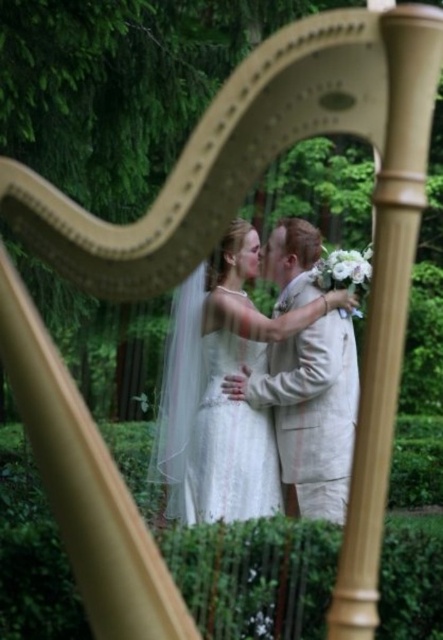
Question: In this image, where is light beige linen suit at center located relative to white lace dress at center?

Choices:
 (A) below
 (B) above

Answer: (B)

Question: Which point appears closest to the camera in this image?

Choices:
 (A) (213, 340)
 (B) (295, 342)

Answer: (A)

Question: Can you confirm if white satin dress at center is wider than light beige linen suit at center?

Choices:
 (A) yes
 (B) no

Answer: (A)

Question: Based on their relative distances, which object is nearer to the light beige linen suit at center?

Choices:
 (A) white satin dress at center
 (B) white lace dress at center

Answer: (A)

Question: Does white satin dress at center appear on the left side of white lace dress at center?

Choices:
 (A) yes
 (B) no

Answer: (B)

Question: Among these points, which one is farthest from the camera?

Choices:
 (A) (178, 339)
 (B) (212, 438)
 (C) (318, 509)

Answer: (A)